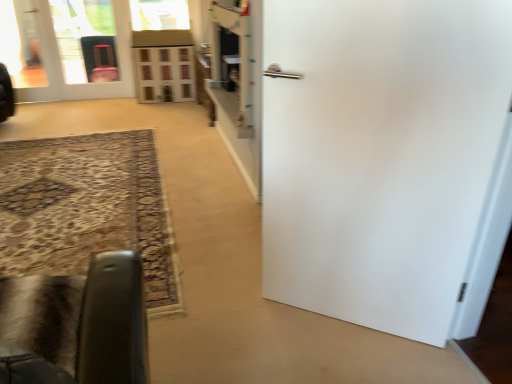
Measure the distance between transparent glass door at upper left and camera.

They are 17.15 feet apart.

The image size is (512, 384). What do you see at coordinates (380, 154) in the screenshot?
I see `white matte door at right, placed as the first door when sorted from right to left` at bounding box center [380, 154].

Based on the photo, what is the approximate width of white matte door at right, arranged as the first door when viewed from the front?

It is 7.33 inches.

This screenshot has width=512, height=384. What do you see at coordinates (62, 68) in the screenshot? I see `matte white door at upper left, marked as the 2th door in a right-to-left arrangement` at bounding box center [62, 68].

Locate an element on the screen. The height and width of the screenshot is (384, 512). transparent glass door at upper left is located at coordinates (86, 40).

Can you confirm if velvet black chair at lower left is positioned to the right of white matte door at right, which is counted as the second door, starting from the left?

No, velvet black chair at lower left is not to the right of white matte door at right, which is counted as the second door, starting from the left.

Can we say velvet black chair at lower left lies outside white matte door at right, placed as the 2th door when sorted from top to bottom?

Yes.

From a real-world perspective, is velvet black chair at lower left positioned above or below white matte door at right, which ranks as the second door in back-to-front order?

Clearly, from a real-world perspective, velvet black chair at lower left is below white matte door at right, which ranks as the second door in back-to-front order.

Considering the sizes of velvet black chair at lower left and white matte door at right, which is counted as the second door, starting from the left, in the image, is velvet black chair at lower left wider or thinner than white matte door at right, which is counted as the second door, starting from the left,?

Clearly, velvet black chair at lower left has more width compared to white matte door at right, which is counted as the second door, starting from the left.

Considering the relative sizes of velvet black chair at lower left and matte white door at upper left, positioned as the 2th door in bottom-to-top order, in the image provided, is velvet black chair at lower left taller than matte white door at upper left, positioned as the 2th door in bottom-to-top order,?

Incorrect, the height of velvet black chair at lower left is not larger of that of matte white door at upper left, positioned as the 2th door in bottom-to-top order.

How different are the orientations of velvet black chair at lower left and matte white door at upper left, the 2th door when ordered from front to back, in degrees?

The facing directions of velvet black chair at lower left and matte white door at upper left, the 2th door when ordered from front to back, are 180 degrees apart.

Between point (137, 345) and point (128, 93), which one is positioned in front?

The point (137, 345) is closer to the camera.

Consider the image. Is matte white door at upper left, placed as the first door when sorted from top to bottom, a part of velvet black chair at lower left?

That's incorrect, matte white door at upper left, placed as the first door when sorted from top to bottom, is not inside velvet black chair at lower left.

How different are the orientations of transparent glass door at upper left and white matte door at right, arranged as the first door when viewed from the front, in degrees?

The angle between the facing direction of transparent glass door at upper left and the facing direction of white matte door at right, arranged as the first door when viewed from the front, is 35.9 degrees.

Considering the relative positions of transparent glass door at upper left and white matte door at right, the first door in the bottom-to-top sequence, in the image provided, is transparent glass door at upper left to the left of white matte door at right, the first door in the bottom-to-top sequence, from the viewer's perspective?

Yes.

Considering the sizes of objects transparent glass door at upper left and white matte door at right, which ranks as the second door in back-to-front order, in the image provided, who is smaller, transparent glass door at upper left or white matte door at right, which ranks as the second door in back-to-front order,?

Smaller between the two is transparent glass door at upper left.

Is transparent glass door at upper left turned away from white matte door at right, the first door in the bottom-to-top sequence?

No, transparent glass door at upper left is not facing away from white matte door at right, the first door in the bottom-to-top sequence.

Between matte white door at upper left, positioned as the 2th door in bottom-to-top order, and wooden dollhouse at center, which one has smaller width?

matte white door at upper left, positioned as the 2th door in bottom-to-top order.

Could you measure the distance between matte white door at upper left, positioned as the 2th door in bottom-to-top order, and wooden dollhouse at center?

A distance of 23.17 inches exists between matte white door at upper left, positioned as the 2th door in bottom-to-top order, and wooden dollhouse at center.

Can you tell me how much matte white door at upper left, the 2th door when ordered from front to back, and wooden dollhouse at center differ in facing direction?

0.584 degrees separate the facing orientations of matte white door at upper left, the 2th door when ordered from front to back, and wooden dollhouse at center.

From the image's perspective, which object appears higher, matte white door at upper left, placed as the first door when sorted from back to front, or wooden dollhouse at center?

From the image's view, matte white door at upper left, placed as the first door when sorted from back to front, is above.

From a real-world perspective, who is located lower, wooden dollhouse at center or velvet black chair at lower left?

From a 3D spatial view, wooden dollhouse at center is below.

Is wooden dollhouse at center facing away from velvet black chair at lower left?

No, wooden dollhouse at center is not facing away from velvet black chair at lower left.

Is the depth of wooden dollhouse at center less than that of velvet black chair at lower left?

No, wooden dollhouse at center is further to the viewer.

Locate an element on the screen. The height and width of the screenshot is (384, 512). window that is on the left side of velvet black chair at lower left is located at coordinates (165, 74).

Consider the image. Which is more to the left, wooden dollhouse at center or white matte door at right, placed as the 2th door when sorted from top to bottom?

From the viewer's perspective, wooden dollhouse at center appears more on the left side.

Which of these two, wooden dollhouse at center or white matte door at right, placed as the 2th door when sorted from top to bottom, is smaller?

white matte door at right, placed as the 2th door when sorted from top to bottom.

Is wooden dollhouse at center beside white matte door at right, arranged as the first door when viewed from the front?

No, wooden dollhouse at center is not making contact with white matte door at right, arranged as the first door when viewed from the front.

Does wooden dollhouse at center have a greater width compared to white matte door at right, placed as the 2th door when sorted from top to bottom?

Yes.

Which is nearer, [159,82] or [116,3]?

Point [116,3]

Consider the image. Can you confirm if wooden dollhouse at center is taller than matte white door at upper left, the 2th door when ordered from front to back?

No, wooden dollhouse at center is not taller than matte white door at upper left, the 2th door when ordered from front to back.

Is wooden dollhouse at center thinner than matte white door at upper left, the 2th door when ordered from front to back?

Incorrect, the width of wooden dollhouse at center is not less than that of matte white door at upper left, the 2th door when ordered from front to back.

Image resolution: width=512 pixels, height=384 pixels. Find the location of `the 1st door above the velvet black chair at lower left (from the image's perspective)`. the 1st door above the velvet black chair at lower left (from the image's perspective) is located at coordinates (380, 154).

Locate an element on the screen. The height and width of the screenshot is (384, 512). the 2nd door behind the velvet black chair at lower left is located at coordinates (62, 68).

Which object lies nearer to the anchor point wooden dollhouse at center, white matte door at right, placed as the 2th door when sorted from top to bottom, or velvet black chair at lower left?

white matte door at right, placed as the 2th door when sorted from top to bottom, is closer to wooden dollhouse at center.

Looking at the image, which one is located closer to velvet black chair at lower left, white matte door at right, which ranks as the second door in back-to-front order, or matte white door at upper left, positioned as the 2th door in bottom-to-top order?

Based on the image, white matte door at right, which ranks as the second door in back-to-front order, appears to be nearer to velvet black chair at lower left.

When comparing their distances from white matte door at right, the first door in the bottom-to-top sequence, does matte white door at upper left, placed as the first door when sorted from top to bottom, or wooden dollhouse at center seem closer?

Based on the image, wooden dollhouse at center appears to be nearer to white matte door at right, the first door in the bottom-to-top sequence.

Looking at the image, which one is located further to velvet black chair at lower left, wooden dollhouse at center or matte white door at upper left, positioned as the 2th door in bottom-to-top order?

The object further to velvet black chair at lower left is matte white door at upper left, positioned as the 2th door in bottom-to-top order.

Consider the image. Looking at the image, which one is located closer to white matte door at right, which ranks as the second door in back-to-front order, transparent glass door at upper left or velvet black chair at lower left?

Based on the image, velvet black chair at lower left appears to be nearer to white matte door at right, which ranks as the second door in back-to-front order.

Based on their spatial positions, is matte white door at upper left, which ranks as the 1th door in left-to-right order, or white matte door at right, the first door in the bottom-to-top sequence, closer to transparent glass door at upper left?

Based on the image, matte white door at upper left, which ranks as the 1th door in left-to-right order, appears to be nearer to transparent glass door at upper left.

Based on the photo, looking at the image, which one is located closer to matte white door at upper left, the 2th door when ordered from front to back, velvet black chair at lower left or transparent glass door at upper left?

transparent glass door at upper left lies closer to matte white door at upper left, the 2th door when ordered from front to back, than the other object.

When comparing their distances from white matte door at right, placed as the first door when sorted from right to left, does transparent glass door at upper left or matte white door at upper left, positioned as the 2th door in bottom-to-top order, seem closer?

matte white door at upper left, positioned as the 2th door in bottom-to-top order, is closer to white matte door at right, placed as the first door when sorted from right to left.

I want to click on door between white matte door at right, placed as the first door when sorted from right to left, and wooden dollhouse at center from front to back, so click(62, 68).

This screenshot has height=384, width=512. I want to click on window located between white matte door at right, which is counted as the second door, starting from the left, and transparent glass door at upper left in the depth direction, so click(165, 74).

The height and width of the screenshot is (384, 512). What are the coordinates of `door positioned between velvet black chair at lower left and matte white door at upper left, marked as the 2th door in a right-to-left arrangement, from near to far` in the screenshot? It's located at (380, 154).

This screenshot has width=512, height=384. Identify the location of door between transparent glass door at upper left and wooden dollhouse at center. (62, 68).